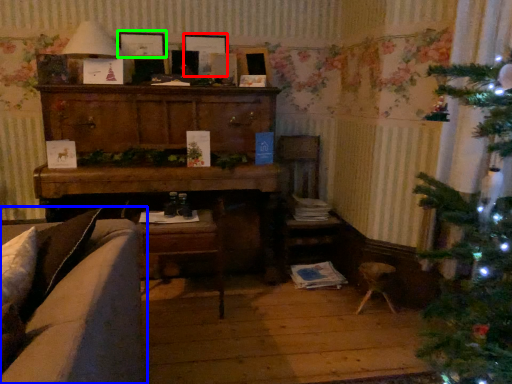
Question: Considering the real-world distances, which object is farthest from picture frame (highlighted by a red box)? studio couch (highlighted by a blue box) or picture frame (highlighted by a green box)?

Choices:
 (A) studio couch
 (B) picture frame

Answer: (A)